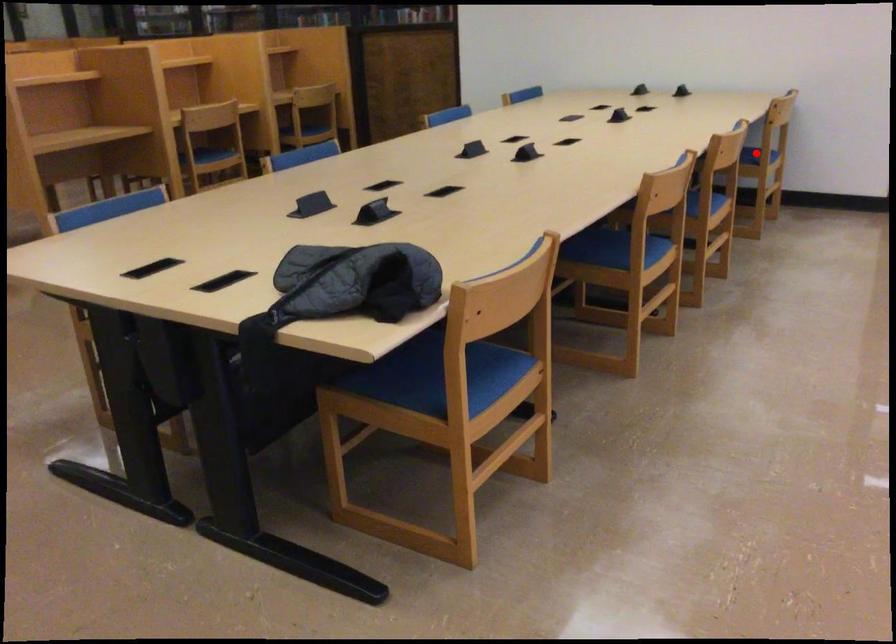
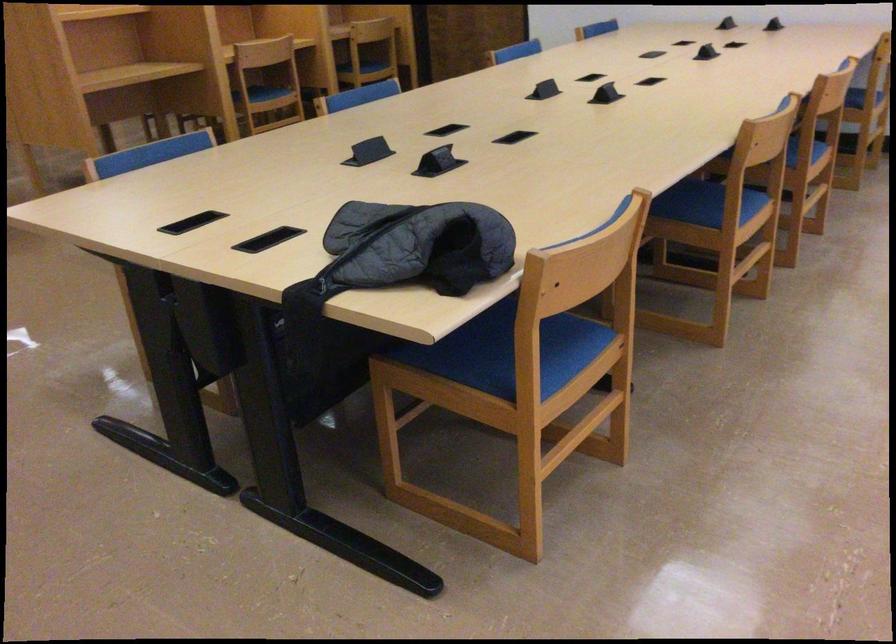
Find the pixel in the second image that matches the highlighted location in the first image.

(869, 90)